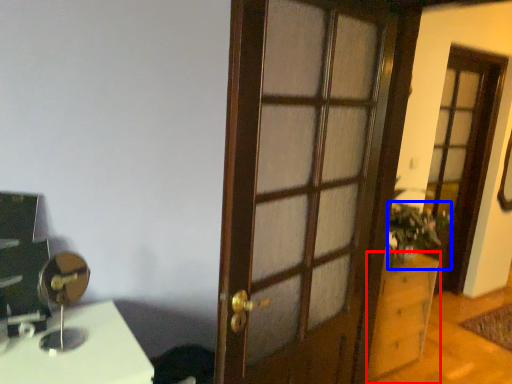
Question: Which object is further to the camera taking this photo, cabinetry (highlighted by a red box) or houseplant (highlighted by a blue box)?

Choices:
 (A) cabinetry
 (B) houseplant

Answer: (B)